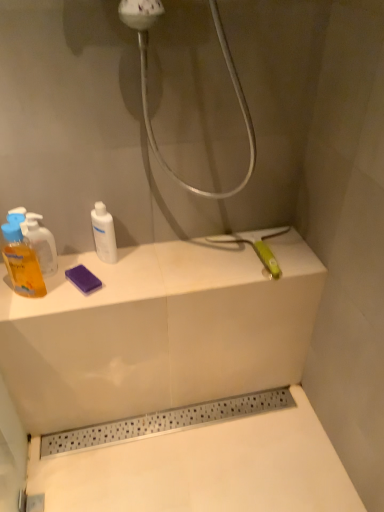
Question: Can you confirm if translucent orange liquid at left, acting as the 2th mouthwash starting from the right, is taller than translucent yellow liquid at left, the first mouthwash when ordered from left to right?

Choices:
 (A) no
 (B) yes

Answer: (A)

Question: Is the depth of translucent orange liquid at left, acting as the second mouthwash starting from the left, less than that of translucent yellow liquid at left, the 3th mouthwash viewed from the right?

Choices:
 (A) no
 (B) yes

Answer: (A)

Question: From the image's perspective, is translucent orange liquid at left, acting as the 2th mouthwash starting from the right, under translucent yellow liquid at left, the 3th mouthwash viewed from the right?

Choices:
 (A) yes
 (B) no

Answer: (B)

Question: Is translucent orange liquid at left, acting as the 2th mouthwash starting from the right, thinner than translucent yellow liquid at left, the first mouthwash when ordered from left to right?

Choices:
 (A) no
 (B) yes

Answer: (B)

Question: Can you confirm if translucent orange liquid at left, acting as the 2th mouthwash starting from the right, is positioned to the right of translucent yellow liquid at left, the 3th mouthwash viewed from the right?

Choices:
 (A) no
 (B) yes

Answer: (B)

Question: Based on their positions, is translucent yellow liquid at left, the first mouthwash when ordered from left to right, located to the left or right of white glossy bottle at center, the first mouthwash viewed from the right?

Choices:
 (A) right
 (B) left

Answer: (B)

Question: From a real-world perspective, is translucent yellow liquid at left, the first mouthwash when ordered from left to right, positioned above or below white glossy bottle at center, which is counted as the 3th mouthwash, starting from the left?

Choices:
 (A) below
 (B) above

Answer: (B)

Question: In the image, is translucent yellow liquid at left, the first mouthwash when ordered from left to right, positioned in front of or behind white glossy bottle at center, the first mouthwash viewed from the right?

Choices:
 (A) front
 (B) behind

Answer: (A)

Question: Is translucent yellow liquid at left, the 3th mouthwash viewed from the right, inside or outside of white glossy bottle at center, which is counted as the 3th mouthwash, starting from the left?

Choices:
 (A) inside
 (B) outside

Answer: (B)

Question: Relative to translucent yellow liquid at left, the 3th mouthwash viewed from the right, is translucent orange liquid at left, acting as the 2th mouthwash starting from the right, in front or behind?

Choices:
 (A) front
 (B) behind

Answer: (B)

Question: Visually, is translucent orange liquid at left, acting as the second mouthwash starting from the left, positioned to the left or to the right of translucent yellow liquid at left, the first mouthwash when ordered from left to right?

Choices:
 (A) left
 (B) right

Answer: (B)

Question: Is translucent orange liquid at left, acting as the second mouthwash starting from the left, spatially inside translucent yellow liquid at left, the first mouthwash when ordered from left to right, or outside of it?

Choices:
 (A) inside
 (B) outside

Answer: (B)

Question: In terms of height, does translucent orange liquid at left, acting as the second mouthwash starting from the left, look taller or shorter compared to translucent yellow liquid at left, the first mouthwash when ordered from left to right?

Choices:
 (A) short
 (B) tall

Answer: (A)

Question: From a real-world perspective, relative to translucent orange liquid at left, acting as the 2th mouthwash starting from the right, is translucent yellow liquid at left, the first mouthwash when ordered from left to right, vertically above or below?

Choices:
 (A) above
 (B) below

Answer: (A)

Question: From the image's perspective, is translucent yellow liquid at left, the 3th mouthwash viewed from the right, located above or below translucent orange liquid at left, acting as the 2th mouthwash starting from the right?

Choices:
 (A) above
 (B) below

Answer: (B)